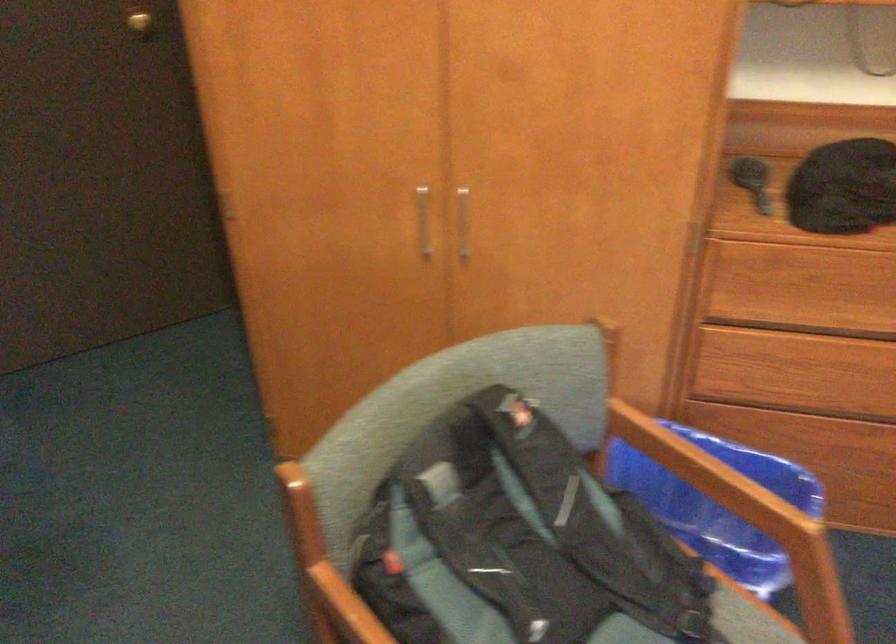
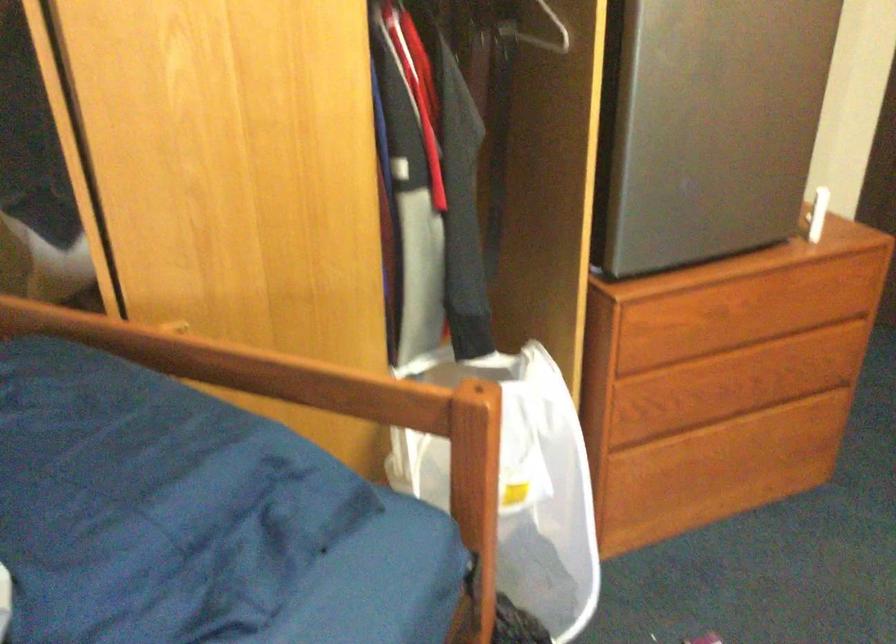
Question: The camera is either moving clockwise (left) or counter-clockwise (right) around the object. The first image is from the beginning of the video and the second image is from the end. Is the camera moving left or right when shooting the video?

Choices:
 (A) Left
 (B) Right

Answer: (B)